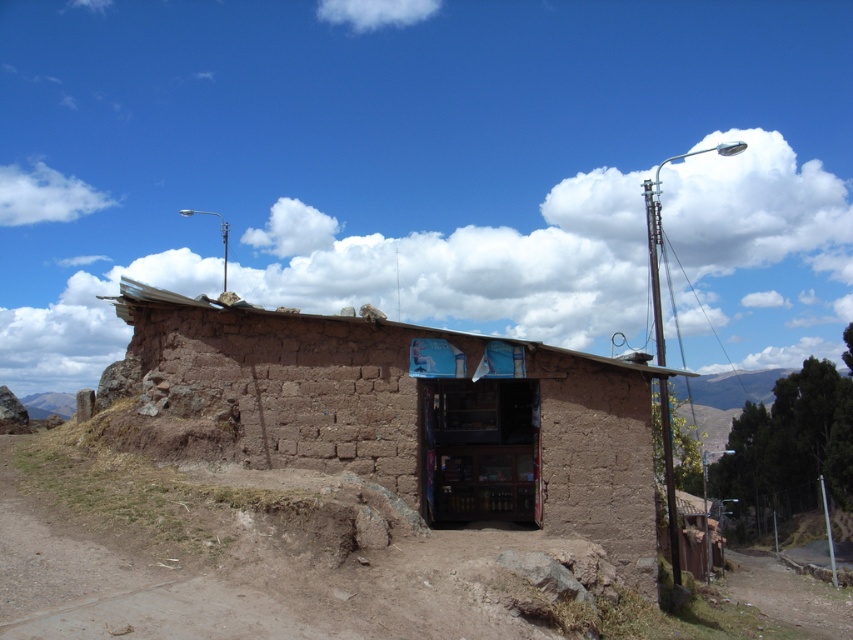
In the scene shown: Does brown dirt track at center appear on the right side of metallic pole at right?

No, brown dirt track at center is not to the right of metallic pole at right.

Is point (59, 612) positioned after point (666, 464)?

No, it is in front of (666, 464).

This screenshot has width=853, height=640. I want to click on brown dirt track at center, so click(245, 556).

Can you confirm if brown mud hut at center is smaller than brown dirt track at center?

Actually, brown mud hut at center might be larger than brown dirt track at center.

Which is more to the left, brown mud hut at center or brown dirt track at center?

brown mud hut at center is more to the left.

Is point (660, 372) behind point (251, 540)?

Yes, point (660, 372) is behind point (251, 540).

I want to click on brown mud hut at center, so click(x=404, y=413).

Does brown mud hut at center appear over metallic pole at right?

Actually, brown mud hut at center is below metallic pole at right.

Is brown mud hut at center shorter than metallic pole at right?

Yes, brown mud hut at center is shorter than metallic pole at right.

Which is behind, point (376, 362) or point (662, 346)?

The point (662, 346) is behind.

Image resolution: width=853 pixels, height=640 pixels. What are the coordinates of `brown mud hut at center` in the screenshot? It's located at tap(404, 413).